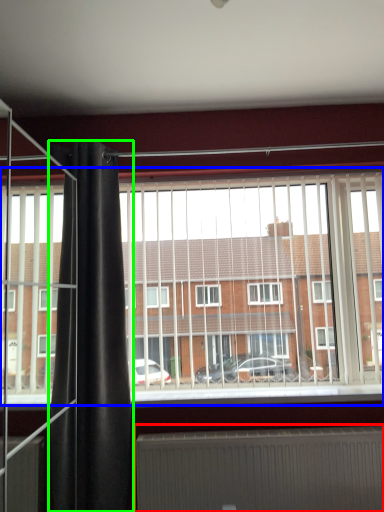
Question: Which object is positioned closest to radiator (highlighted by a red box)? Select from window (highlighted by a blue box) and shower curtain (highlighted by a green box).

Choices:
 (A) window
 (B) shower curtain

Answer: (A)